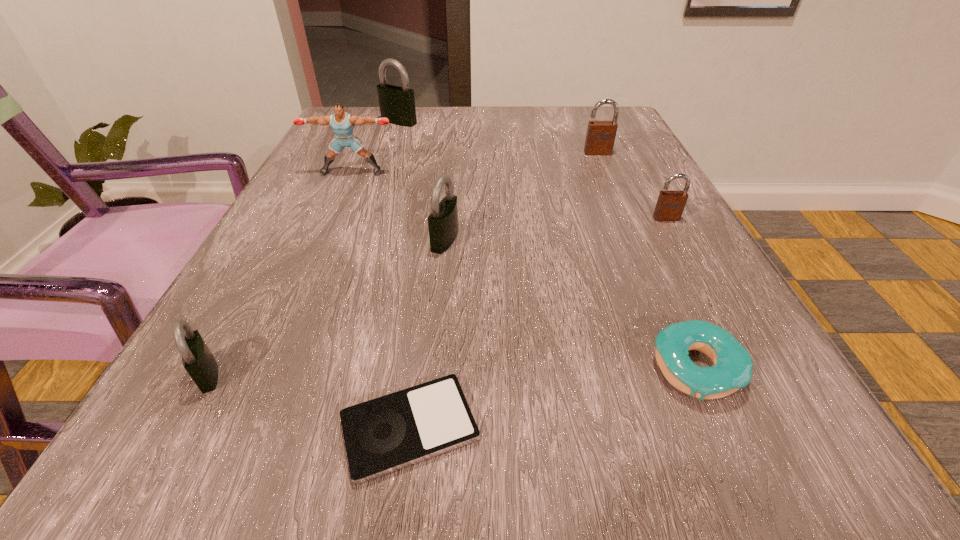
Locate an element on the screen. the fifth nearest object is located at coordinates pos(670,205).

At what (x,y) coordinates should I click in order to perform the action: click on the third farthest padlock. Please return your answer as a coordinate pair (x, y). This screenshot has width=960, height=540. Looking at the image, I should click on (670, 205).

At what (x,y) coordinates should I click in order to perform the action: click on the seventh tallest object. Please return your answer as a coordinate pair (x, y). Looking at the image, I should click on (732, 370).

I want to click on iPod, so click(388, 433).

I want to click on gray iPod, so click(x=388, y=433).

Identify the location of free space located 0.050m on the front of the biggest black padlock. Image resolution: width=960 pixels, height=540 pixels. (395, 136).

I want to click on free location located on the front-facing side of the puncher, so click(x=292, y=309).

The height and width of the screenshot is (540, 960). In order to click on blank area located 0.340m on the front of the fourth nearest object in this screenshot , I will do `click(424, 456)`.

This screenshot has height=540, width=960. In order to click on free region located 0.210m on the front-facing side of the left brown padlock in this screenshot , I will do `click(621, 207)`.

I want to click on vacant space situated on the right of the smallest black padlock, so click(312, 374).